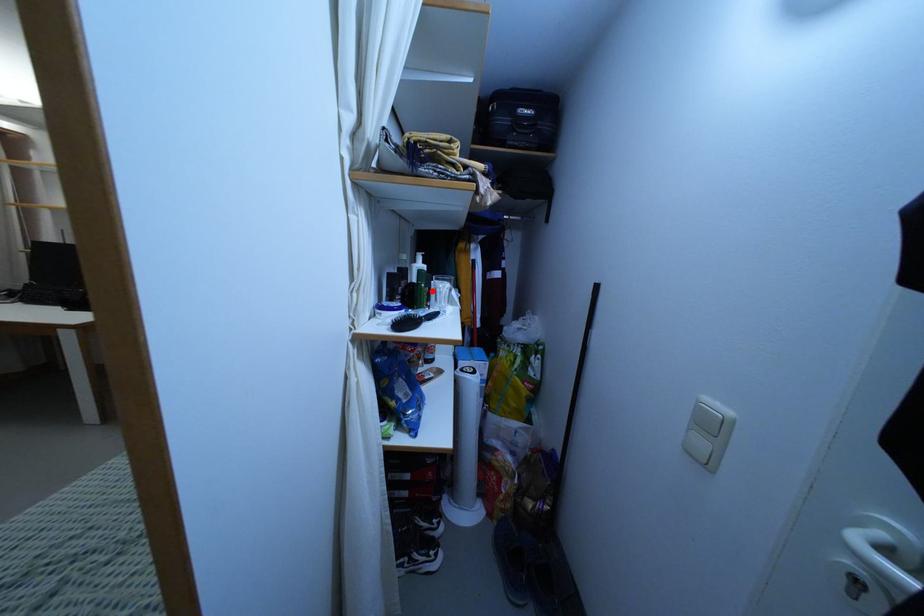
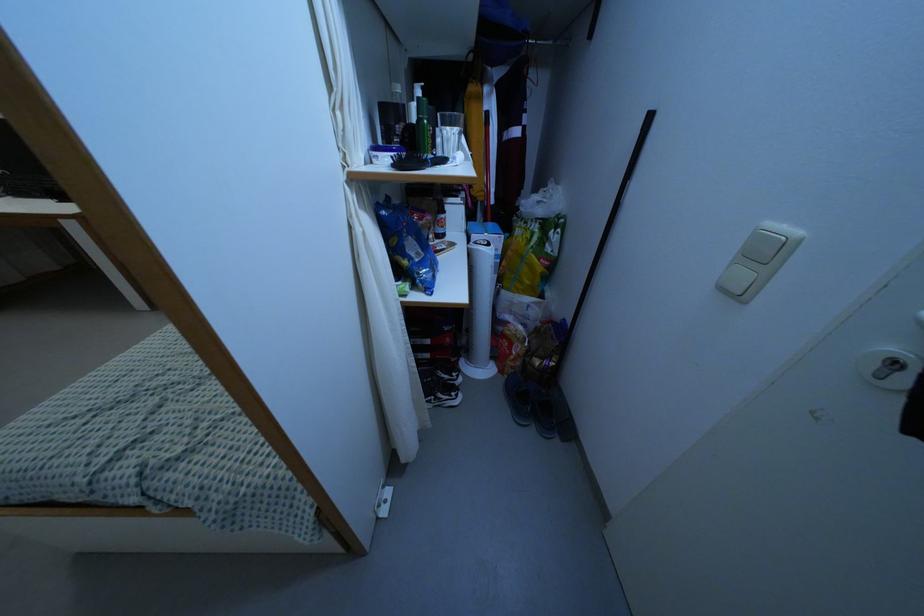
In the second image, find the point that corresponds to the highlighted location in the first image.

(438, 140)